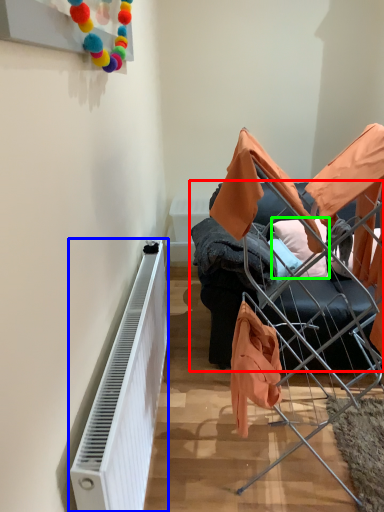
Question: Based on their relative distances, which object is farther from furniture (highlighted by a red box)? Choose from radiator (highlighted by a blue box) and pillow (highlighted by a green box).

Choices:
 (A) radiator
 (B) pillow

Answer: (A)